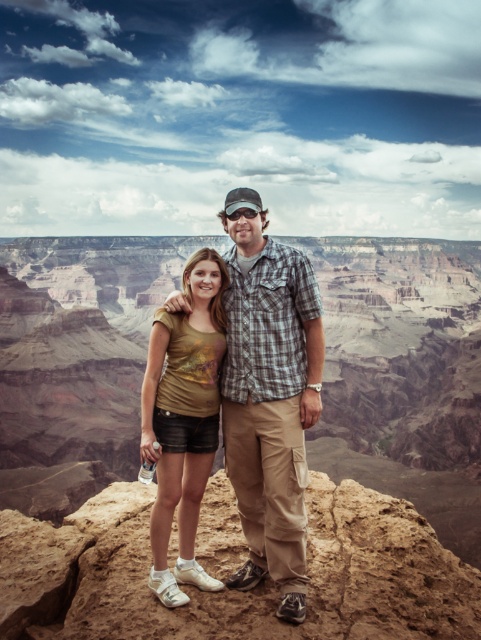
You are a photographer positioned at the cliff edge and want to capture a photo of the matte gold shirt at center. Given that your camera has a focal length of 50mm and the shirt is at coordinates point0.620,0.561, will the shirt be in the center of the photo?

The matte gold shirt at center is located at point0.(x=269, y=639), so yes, it will be in the center of the photo since the coordinates indicate its position is at the center.

You are standing at the cliff edge overlooking the canyon and want to take a photo of both points. Which point, point (276, 540) or point (207, 584), is closer to you?

Point (276, 540) is closer to you because it is further to the viewer than point (207, 584).

You are a photographer planning to take a group photo of the two people in the image. The matte gold shirt at center and the gold metallic shirt at center are standing side by side. Which person should move to the left to ensure both can fit within the camera frame without overlapping?

The matte gold shirt at center should move to the left because it is wider than the gold metallic shirt at center, so moving it left would create more space between them.